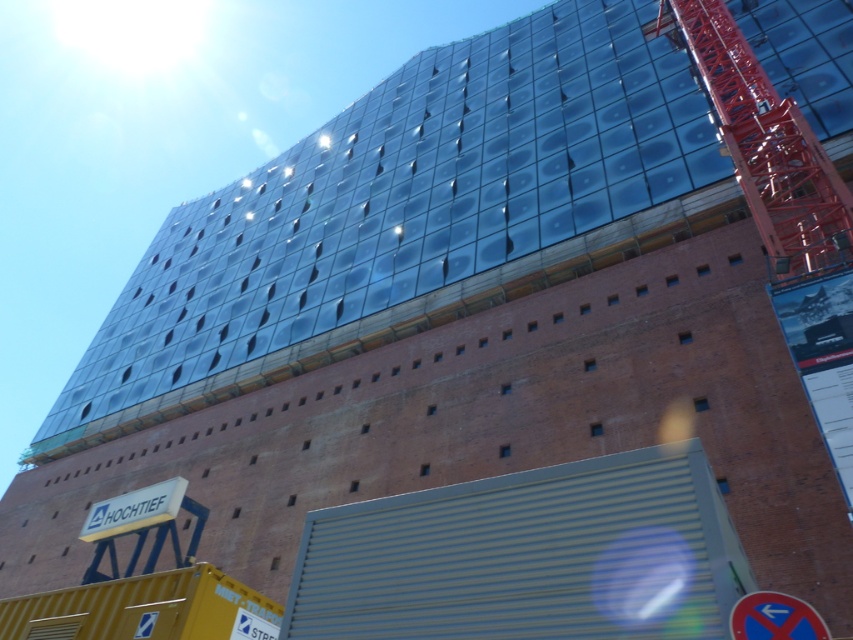
Question: Among these objects, which one is farthest from the camera?

Choices:
 (A) blue plastic sign at lower right
 (B) metallic red crane at right

Answer: (B)

Question: Can you confirm if metallic red crane at right is bigger than blue plastic sign at lower right?

Choices:
 (A) yes
 (B) no

Answer: (A)

Question: Which point is farther to the camera?

Choices:
 (A) (749, 609)
 (B) (791, 220)

Answer: (B)

Question: Does metallic red crane at right come in front of blue plastic sign at lower right?

Choices:
 (A) yes
 (B) no

Answer: (B)

Question: Does metallic red crane at right have a smaller size compared to blue plastic sign at lower right?

Choices:
 (A) no
 (B) yes

Answer: (A)

Question: Which of the following is the farthest from the observer?

Choices:
 (A) (677, 12)
 (B) (804, 600)

Answer: (A)